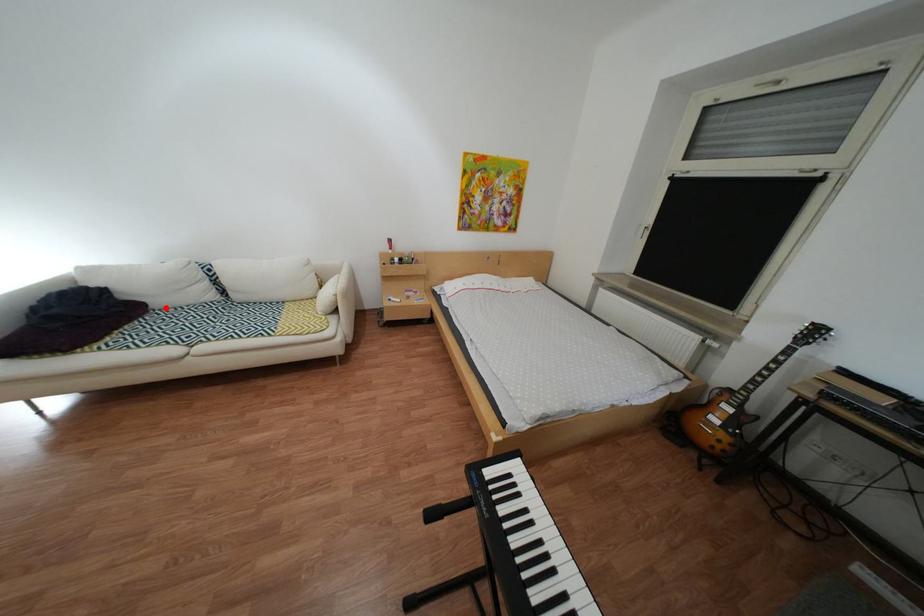
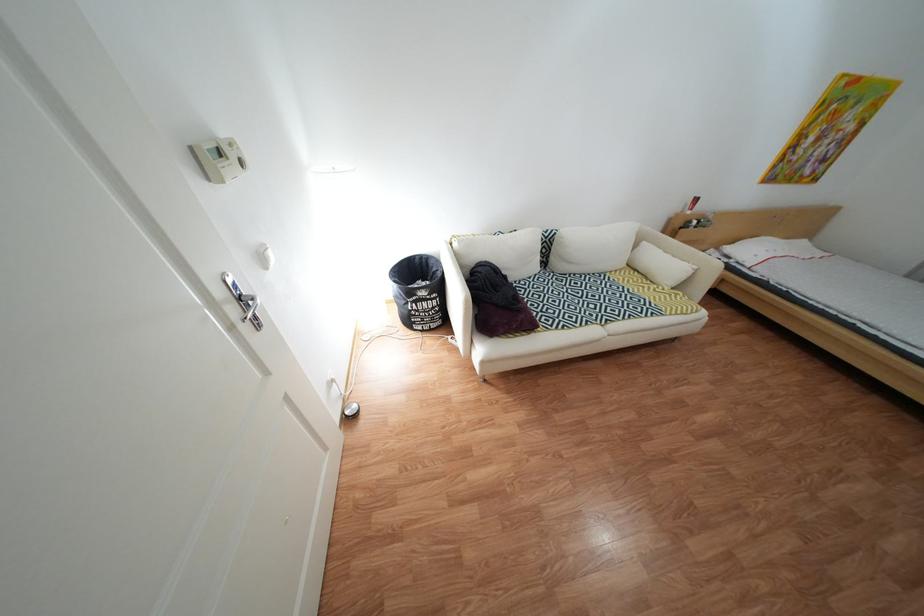
Question: I am providing you with two images of the same scene from different viewpoints. Image1 has a red point marked. In image2, the corresponding 3D location appears at what relative position? Reply with the corresponding letter.

Choices:
 (A) Closer
 (B) Farther

Answer: (B)